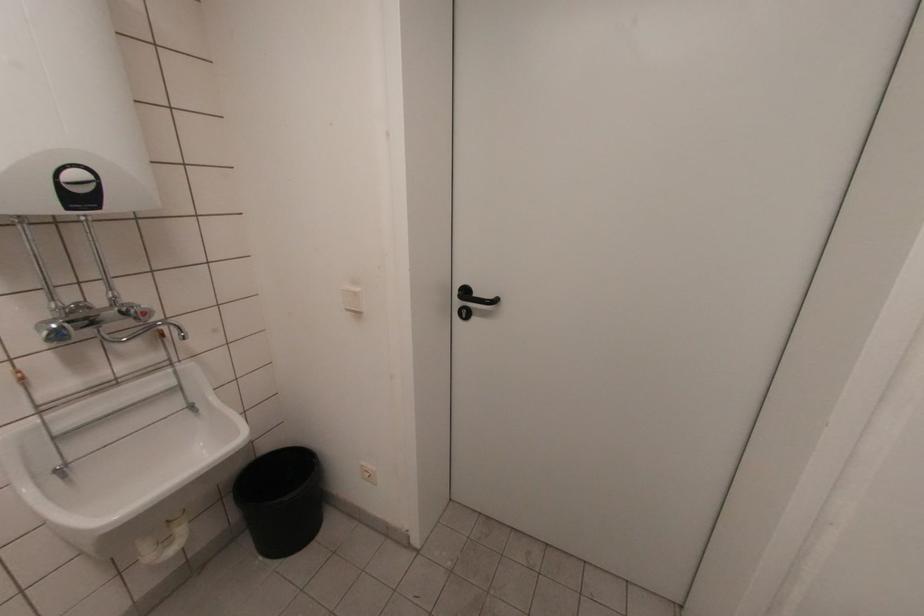
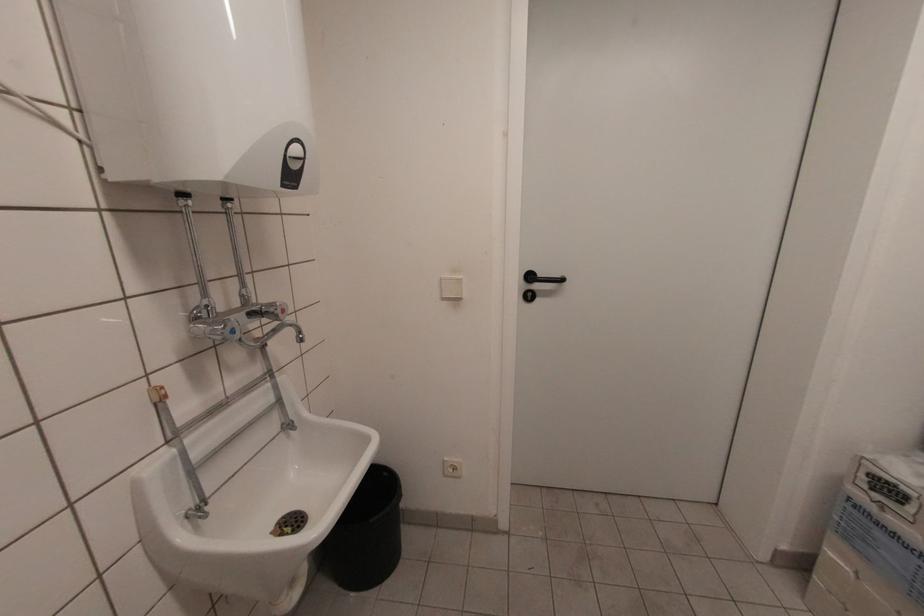
Question: In a continuous first-person perspective shot, in which direction is the camera moving?

Choices:
 (A) Left
 (B) Right
 (C) Forward
 (D) Backward

Answer: (A)